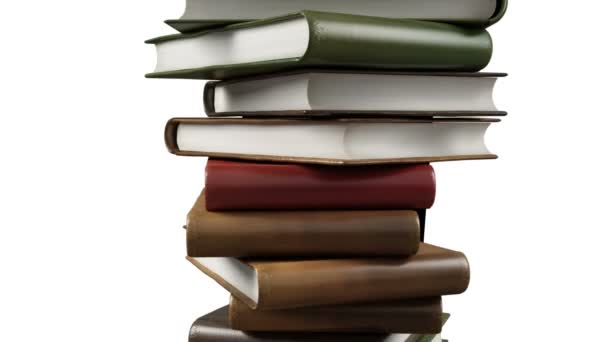
Identify the location of books. The image size is (608, 342). (225, 329), (247, 323), (295, 290), (315, 226), (330, 186), (345, 152), (365, 108), (359, 56), (416, 23).